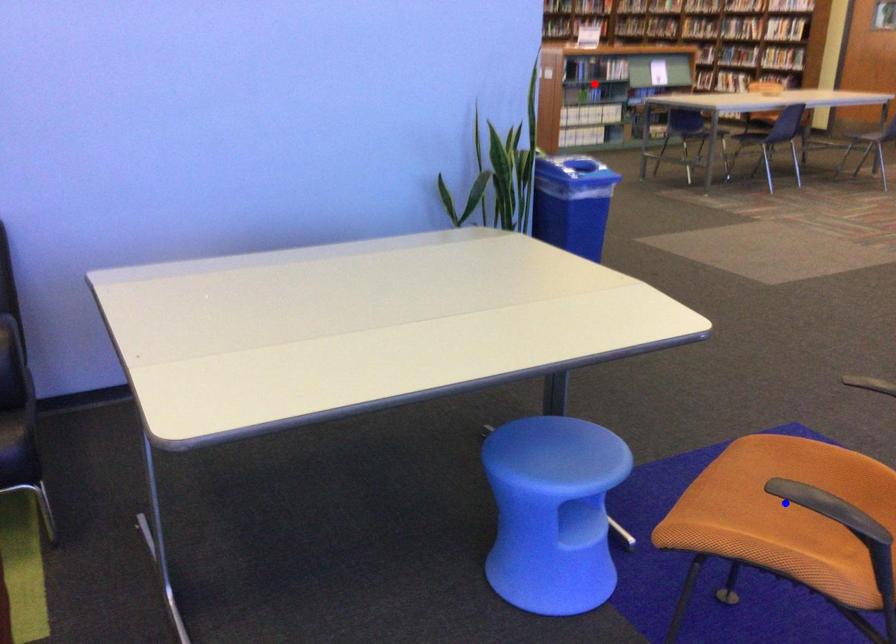
Question: Two points are marked on the image. Which point is closer to the camera?

Choices:
 (A) Blue point is closer.
 (B) Red point is closer.

Answer: (A)